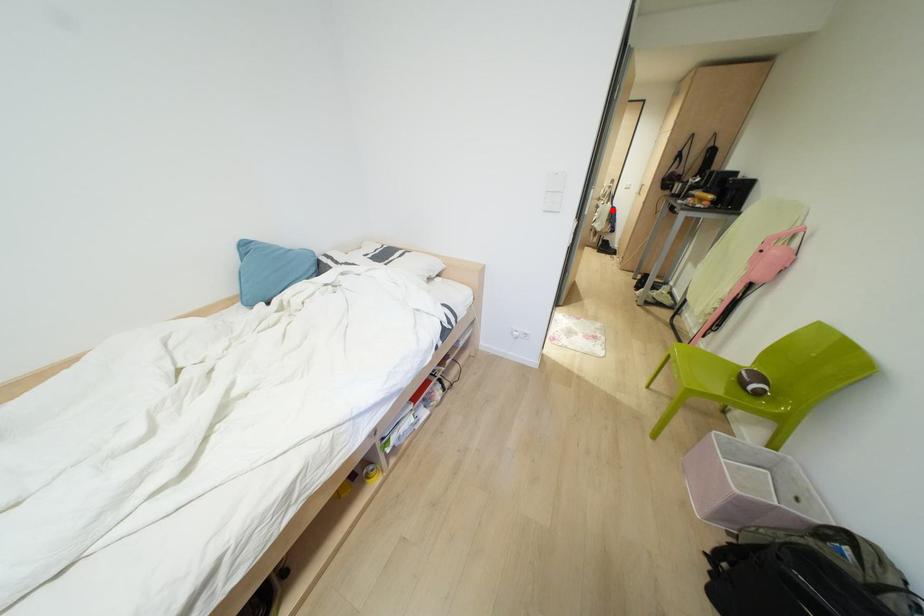
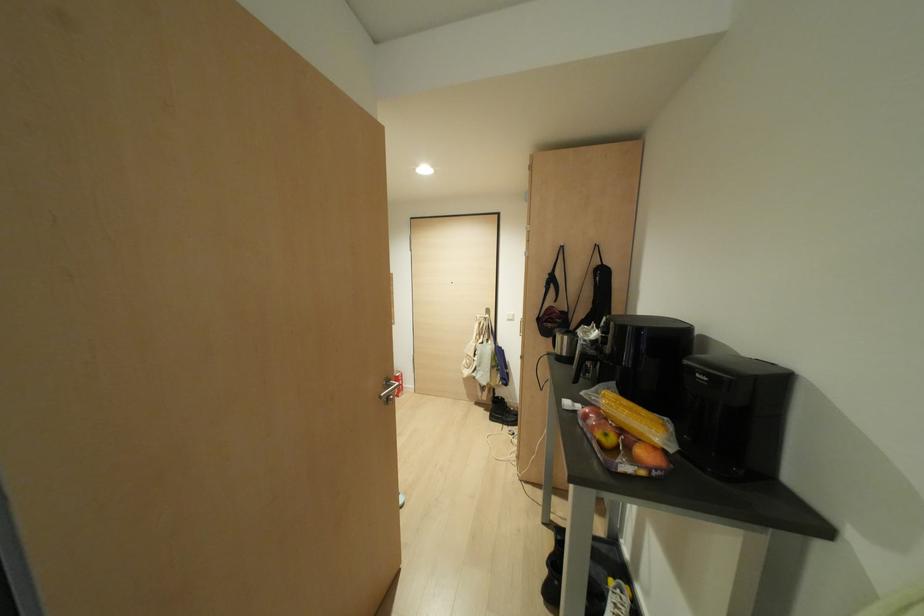
Question: I am providing you with two images of the same scene from different viewpoints. Image1 has a red point marked. In image2, the corresponding 3D location appears at what relative position? Reply with the corresponding letter.

Choices:
 (A) Closer
 (B) Farther

Answer: (A)